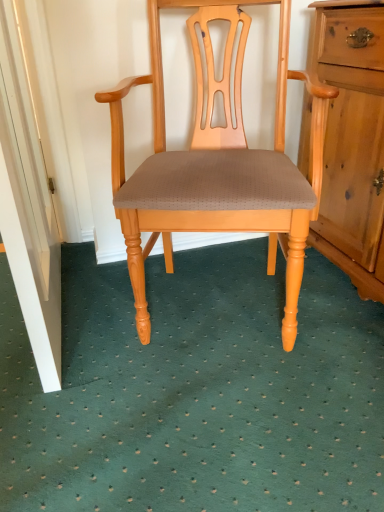
Locate an element on the screen. free space in front of light wood/finely carvedchair at center is located at coordinates (211, 435).